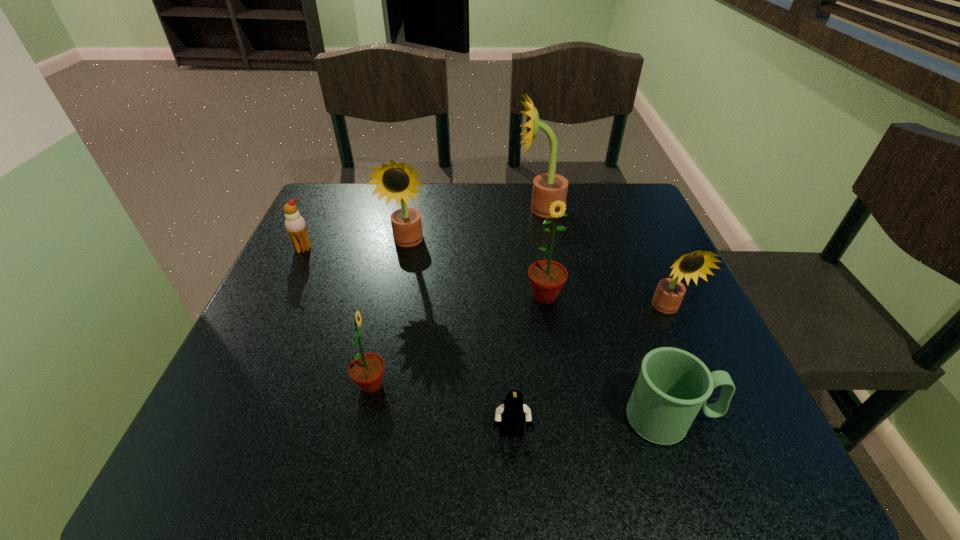
The width and height of the screenshot is (960, 540). Find the location of `vacant region at the near edge`. vacant region at the near edge is located at coordinates (645, 447).

This screenshot has height=540, width=960. In order to click on vacant area at the left edge of the desktop in this screenshot , I will do `click(313, 257)`.

Where is `free location at the right edge`? The height and width of the screenshot is (540, 960). free location at the right edge is located at coordinates (681, 311).

Locate an element on the screen. This screenshot has width=960, height=540. free space at the far left corner of the desktop is located at coordinates (320, 201).

Locate an element on the screen. The width and height of the screenshot is (960, 540). free space at the far right corner of the desktop is located at coordinates (614, 219).

The height and width of the screenshot is (540, 960). Identify the location of free spot between the icecream and the smaller green sunflower. (337, 317).

Locate an element on the screen. unoccupied position between the rightmost sunflower and the leftmost object is located at coordinates (485, 279).

The width and height of the screenshot is (960, 540). I want to click on empty space that is in between the fourth nearest sunflower and the leftmost object, so [x=355, y=246].

The image size is (960, 540). What are the coordinates of `vacant space that's between the farther green sunflower and the fifth object from right to left` in the screenshot? It's located at (528, 365).

I want to click on free area in between the nearer green sunflower and the bigger green sunflower, so click(458, 341).